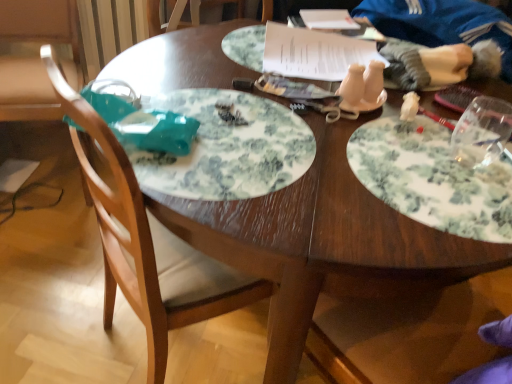
Measure the distance between wooden chair at left and camera.

wooden chair at left is 22.37 inches away from camera.

Consider the image. Measure the distance between point (164,182) and camera.

They are 62.80 centimeters apart.

Image resolution: width=512 pixels, height=384 pixels. Identify the location of white paper at upper center. (297, 51).

Between white floral plate at center, which is the second plate from right to left, and white fabric doll at upper right, which one has smaller size?

Smaller between the two is white floral plate at center, which is the second plate from right to left.

Which is more distant, (247, 111) or (380, 26)?

Point (380, 26)

Looking at this image, is white floral plate at center, placed as the first plate when sorted from left to right, in contact with white fabric doll at upper right?

white floral plate at center, placed as the first plate when sorted from left to right, and white fabric doll at upper right are not in contact.

In the scene shown: How much distance is there between white floral plate at center, which is the second plate from right to left, and white fabric doll at upper right?

white floral plate at center, which is the second plate from right to left, and white fabric doll at upper right are 28.92 inches apart from each other.

Which is less distant, (x=498, y=177) or (x=265, y=34)?

The point (x=498, y=177) is closer to the camera.

Is white floral plate at right, acting as the 2th plate starting from the left, thinner than white paper at upper center?

In fact, white floral plate at right, acting as the 2th plate starting from the left, might be wider than white paper at upper center.

Could you measure the distance between white floral plate at right, acting as the 2th plate starting from the left, and white paper at upper center?

The distance of white floral plate at right, acting as the 2th plate starting from the left, from white paper at upper center is 14.13 inches.

Who is bigger, white floral plate at right, acting as the 2th plate starting from the left, or white paper at upper center?

Bigger between the two is white paper at upper center.

Is wooden chair at left oriented towards white floral plate at center, placed as the first plate when sorted from left to right?

No, wooden chair at left is not oriented towards white floral plate at center, placed as the first plate when sorted from left to right.

Can you confirm if wooden chair at left is positioned to the left of white floral plate at center, which is the second plate from right to left?

Indeed, wooden chair at left is positioned on the left side of white floral plate at center, which is the second plate from right to left.

Consider the image. Is there a large distance between wooden chair at left and white floral plate at center, which is the second plate from right to left?

No, wooden chair at left is in close proximity to white floral plate at center, which is the second plate from right to left.

From the image's perspective, relative to white floral plate at center, placed as the first plate when sorted from left to right, is wooden chair at left above or below?

wooden chair at left is below white floral plate at center, placed as the first plate when sorted from left to right.

Is white fabric doll at upper right to the right of white floral plate at right, acting as the 2th plate starting from the left, from the viewer's perspective?

Yes.

How many degrees apart are the facing directions of white fabric doll at upper right and white floral plate at right, acting as the 2th plate starting from the left?

The angular difference between white fabric doll at upper right and white floral plate at right, acting as the 2th plate starting from the left, is 2.49 degrees.

Considering the points (414, 22) and (370, 126), which point is in front, point (414, 22) or point (370, 126)?

Point (370, 126)

From a real-world perspective, between white fabric doll at upper right and white floral plate at right, acting as the 2th plate starting from the left, who is vertically lower?

From a 3D spatial view, white floral plate at right, acting as the 2th plate starting from the left, is below.

Is white floral plate at center, placed as the first plate when sorted from left to right, looking in the opposite direction of white paper at upper center?

No, white paper at upper center is not at the back of white floral plate at center, placed as the first plate when sorted from left to right.

Is white floral plate at center, which is the second plate from right to left, at the left side of white paper at upper center?

Correct, you'll find white floral plate at center, which is the second plate from right to left, to the left of white paper at upper center.

Considering the relative sizes of white floral plate at center, which is the second plate from right to left, and white paper at upper center in the image provided, is white floral plate at center, which is the second plate from right to left, smaller than white paper at upper center?

Correct, white floral plate at center, which is the second plate from right to left, occupies less space than white paper at upper center.

Considering the sizes of objects white floral plate at center, which is the second plate from right to left, and white paper at upper center in the image provided, who is wider, white floral plate at center, which is the second plate from right to left, or white paper at upper center?

white floral plate at center, which is the second plate from right to left, is wider.

Which object is further away from the camera, white fabric doll at upper right or white paper at upper center?

Positioned behind is white paper at upper center.

From their relative heights in the image, would you say white fabric doll at upper right is taller or shorter than white paper at upper center?

Considering their sizes, white fabric doll at upper right has more height than white paper at upper center.

Consider the image. Can you confirm if white fabric doll at upper right is wider than white paper at upper center?

Incorrect, the width of white fabric doll at upper right does not surpass that of white paper at upper center.

From the picture: How different are the orientations of white fabric doll at upper right and white paper at upper center in degrees?

The angular difference between white fabric doll at upper right and white paper at upper center is 30.3 degrees.

Considering the relative sizes of wooden chair at left and white fabric doll at upper right in the image provided, is wooden chair at left thinner than white fabric doll at upper right?

No, wooden chair at left is not thinner than white fabric doll at upper right.

How much distance is there between wooden chair at left and white fabric doll at upper right?

The distance of wooden chair at left from white fabric doll at upper right is 37.16 inches.

Is wooden chair at left far away from white fabric doll at upper right?

Actually, wooden chair at left and white fabric doll at upper right are a little close together.

Considering the relative positions of wooden chair at left and white fabric doll at upper right in the image provided, is wooden chair at left behind white fabric doll at upper right?

That is False.

In order to click on the 1st plate in front when counting from the white fabric doll at upper right in this screenshot , I will do `click(227, 147)`.

Find the location of `platter on the left of white floral plate at right, acting as the 2th plate starting from the left`. platter on the left of white floral plate at right, acting as the 2th plate starting from the left is located at coordinates (297, 51).

Which object lies nearer to the anchor point white floral plate at right, the first plate when ordered from right to left, white paper at upper center or white fabric doll at upper right?

The object closer to white floral plate at right, the first plate when ordered from right to left, is white paper at upper center.

Which object lies further to the anchor point wooden chair at left, white floral plate at center, which is the second plate from right to left, or white paper at upper center?

white paper at upper center is further to wooden chair at left.

Consider the image. When comparing their distances from white floral plate at center, placed as the first plate when sorted from left to right, does white paper at upper center or white floral plate at right, the first plate when ordered from right to left, seem further?

white paper at upper center is further to white floral plate at center, placed as the first plate when sorted from left to right.

Looking at this image, when comparing their distances from white fabric doll at upper right, does white floral plate at center, placed as the first plate when sorted from left to right, or wooden chair at left seem closer?

white floral plate at center, placed as the first plate when sorted from left to right.

Looking at the image, which one is located closer to white floral plate at right, the first plate when ordered from right to left, wooden chair at left or white paper at upper center?

The object closer to white floral plate at right, the first plate when ordered from right to left, is white paper at upper center.

Estimate the real-world distances between objects in this image. Which object is further from wooden chair at left, white fabric doll at upper right or white floral plate at center, which is the second plate from right to left?

white fabric doll at upper right lies further to wooden chair at left than the other object.

When comparing their distances from white floral plate at center, which is the second plate from right to left, does white fabric doll at upper right or wooden chair at left seem further?

white fabric doll at upper right lies further to white floral plate at center, which is the second plate from right to left, than the other object.

Looking at the image, which one is located further to wooden chair at left, white floral plate at right, acting as the 2th plate starting from the left, or white floral plate at center, which is the second plate from right to left?

Based on the image, white floral plate at right, acting as the 2th plate starting from the left, appears to be further to wooden chair at left.

This screenshot has height=384, width=512. Identify the location of plate between white floral plate at center, which is the second plate from right to left, and white fabric doll at upper right from left to right. (432, 179).

Locate an element on the screen. plate between white floral plate at right, acting as the 2th plate starting from the left, and white paper at upper center, along the z-axis is located at coordinates (227, 147).

This screenshot has height=384, width=512. Find the location of `plate located between wooden chair at left and white floral plate at right, acting as the 2th plate starting from the left, in the left-right direction`. plate located between wooden chair at left and white floral plate at right, acting as the 2th plate starting from the left, in the left-right direction is located at coordinates (227, 147).

You are a GUI agent. You are given a task and a screenshot of the screen. Output one action in this format:
    pyautogui.click(x=<x>, y=<y>)
    Task: Click on the platter located between white floral plate at center, which is the second plate from right to left, and white fabric doll at upper right in the left-right direction
    
    Given the screenshot: What is the action you would take?
    pyautogui.click(x=297, y=51)